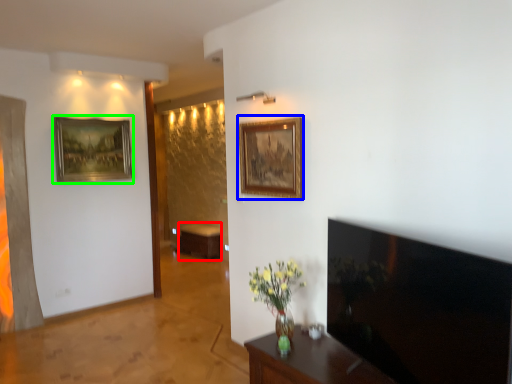
Question: Considering the real-world distances, which object is closest to table (highlighted by a red box)? picture frame (highlighted by a blue box) or picture frame (highlighted by a green box).

Choices:
 (A) picture frame
 (B) picture frame

Answer: (B)